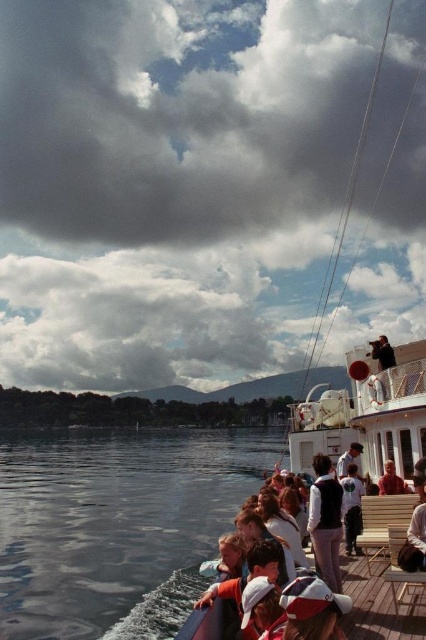
Can you confirm if clear water at lower left is positioned below wooden deck boat at center?

Correct, clear water at lower left is located below wooden deck boat at center.

Consider the image. How much distance is there between clear water at lower left and wooden deck boat at center?

They are 238.10 feet apart.

Does point (40, 561) come closer to viewer compared to point (399, 362)?

No, it is not.

Find the location of a particular element. This screenshot has height=640, width=426. clear water at lower left is located at coordinates (117, 525).

Which is above, clear water at lower left or wooden deck at center?

wooden deck at center is higher up.

Can you confirm if clear water at lower left is wider than wooden deck at center?

Yes.

Which is behind, point (39, 461) or point (385, 625)?

Point (39, 461)

Image resolution: width=426 pixels, height=640 pixels. What are the coordinates of `clear water at lower left` in the screenshot? It's located at (117, 525).

Consider the image. Who is more distant from viewer, (112, 451) or (388, 460)?

Point (112, 451)

How far apart are clear water at lower left and red velvet coat at center?

clear water at lower left and red velvet coat at center are 101.07 meters apart from each other.

What are the coordinates of `clear water at lower left` in the screenshot? It's located at (117, 525).

Locate an element on the screen. The height and width of the screenshot is (640, 426). clear water at lower left is located at coordinates (117, 525).